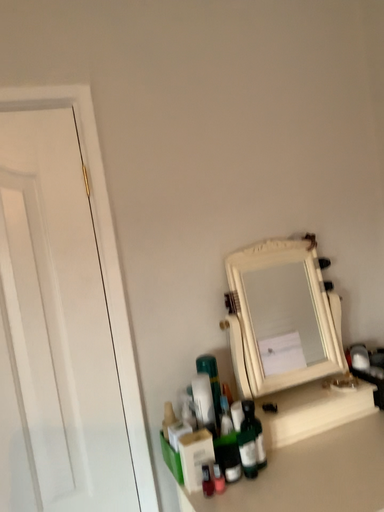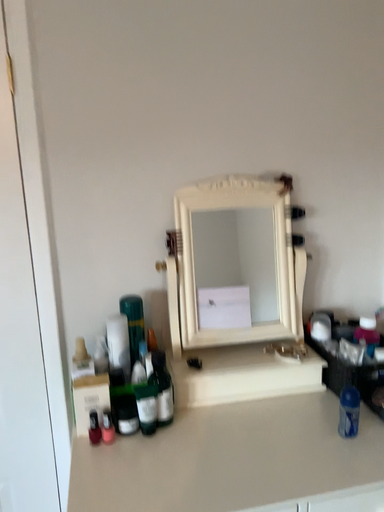
Question: How did the camera likely rotate when shooting the video?

Choices:
 (A) rotated left
 (B) rotated right

Answer: (A)